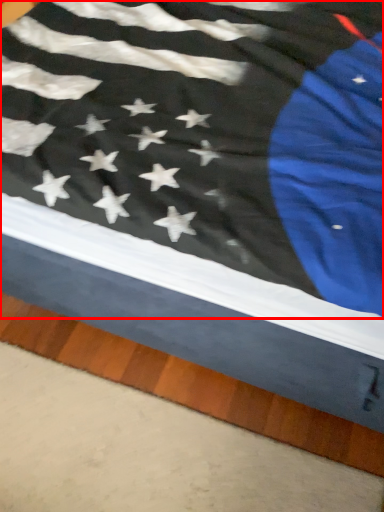
Question: From the image's perspective, where is flag (annotated by the red box) located relative to plank?

Choices:
 (A) below
 (B) above

Answer: (B)